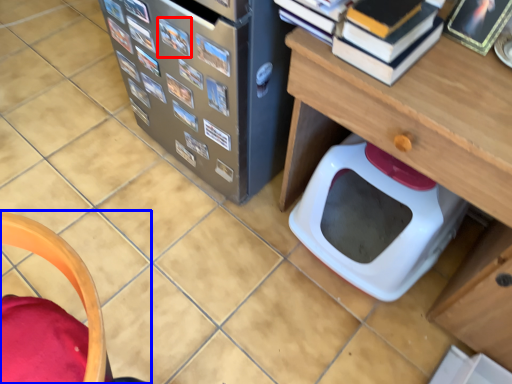
Question: Which point is closer to the camera, book (highlighted by a red box) or furniture (highlighted by a blue box)?

Choices:
 (A) book
 (B) furniture

Answer: (B)